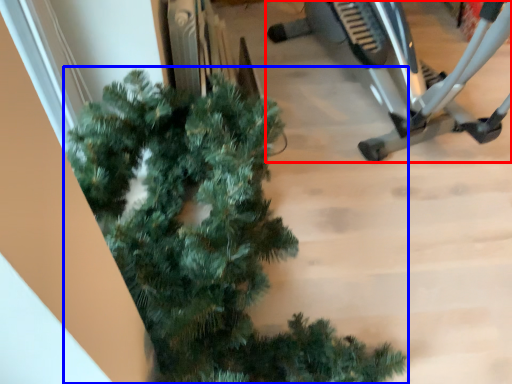
Question: Which of the following is the closest to the observer, stationary bicycle (highlighted by a red box) or christmas tree (highlighted by a blue box)?

Choices:
 (A) stationary bicycle
 (B) christmas tree

Answer: (B)